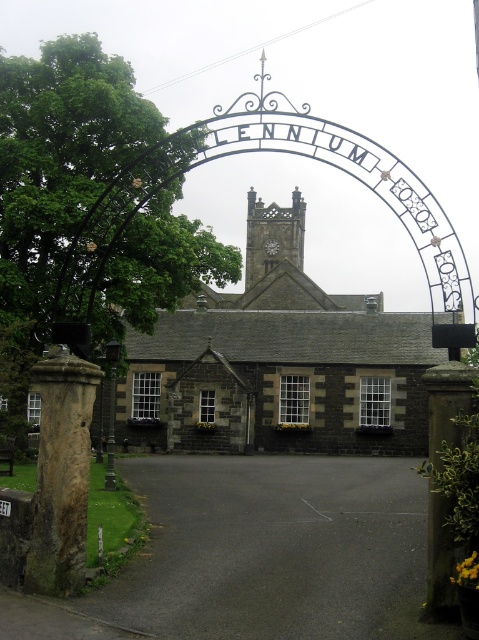
Question: Can you confirm if brown stone pillar at left is smaller than brown stone pillar at right?

Choices:
 (A) yes
 (B) no

Answer: (A)

Question: Which point is farther to the camera?

Choices:
 (A) dark gray stone church at center
 (B) brown stone pillar at right

Answer: (A)

Question: Does black asphalt driveway at center have a larger size compared to brown stone pillar at left?

Choices:
 (A) no
 (B) yes

Answer: (B)

Question: Among these objects, which one is nearest to the camera?

Choices:
 (A) black asphalt driveway at center
 (B) dark gray stone church at center
 (C) brown stone pillar at right
 (D) brown stone pillar at left

Answer: (A)

Question: Is black asphalt driveway at center to the right of dark gray stone church at center from the viewer's perspective?

Choices:
 (A) yes
 (B) no

Answer: (B)

Question: Among these objects, which one is farthest from the camera?

Choices:
 (A) dark gray stone church at center
 (B) brown stone pillar at right
 (C) green leafy tree at left
 (D) black asphalt driveway at center

Answer: (C)